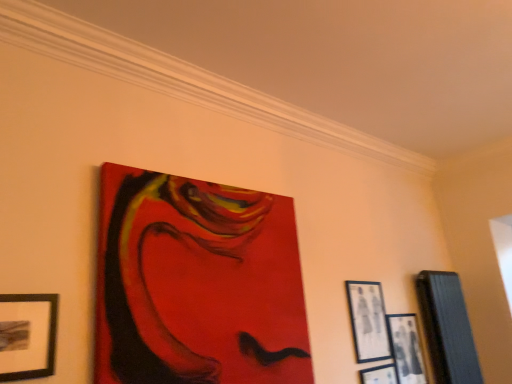
Question: Would you say black matte picture frame at lower right, positioned as the 2th picture frame in right-to-left order, is to the left or to the right of wooden picture frame at right, which is the 5th picture frame in left-to-right order, in the picture?

Choices:
 (A) left
 (B) right

Answer: (A)

Question: In terms of height, does black matte picture frame at lower right, the fourth picture frame viewed from the left, look taller or shorter compared to wooden picture frame at right, which is the 5th picture frame in left-to-right order?

Choices:
 (A) tall
 (B) short

Answer: (B)

Question: Estimate the real-world distances between objects in this image. Which object is farther from the black matte picture frame at lower right, positioned as the 2th picture frame in right-to-left order?

Choices:
 (A) wooden picture frame at right, which is the 1th picture frame in right-to-left order
 (B) matte acrylic painting at upper center, which is counted as the first picture frame, starting from the left
 (C) matte black picture frame at upper right, which ranks as the 2th picture frame in left-to-right order
 (D) matte black picture frame at lower right, which appears as the third picture frame when viewed from the left

Answer: (B)

Question: Based on their relative distances, which object is farther from the matte black picture frame at lower right, which appears as the third picture frame when viewed from the left?

Choices:
 (A) matte acrylic painting at upper center, marked as the 5th picture frame in a right-to-left arrangement
 (B) black matte picture frame at lower right, the fourth picture frame viewed from the left
 (C) wooden picture frame at right, which is the 1th picture frame in right-to-left order
 (D) matte black picture frame at upper right, which is the 4th picture frame from right to left

Answer: (A)